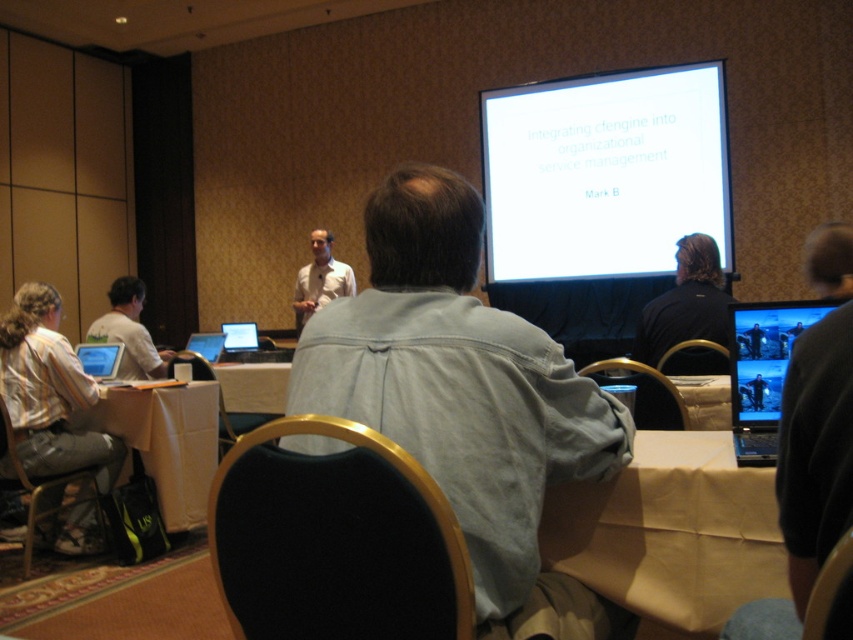
You are a participant in the conference room and need to reach the matte black laptop at center to take notes. There is a brown paper bag at lower right in your way. Can you easily access the laptop without moving the bag?

The brown paper bag at lower right is closer to the viewer than the matte black laptop at center, so the bag is blocking the path to the laptop. You would need to move the bag to access the laptop.

You are organizing a small event in this conference room and need to place a decorative plant pot between the brown paper bag at lower left and the black plastic chair at center. The plant pot must be shorter than both objects. Is this possible?

The brown paper bag at lower left is taller than the black plastic chair at center. Since the plant pot needs to be shorter than both, it must be shorter than the black plastic chair at center, which is the shorter of the two. This is possible as long as the plant pot is shorter than the chair.